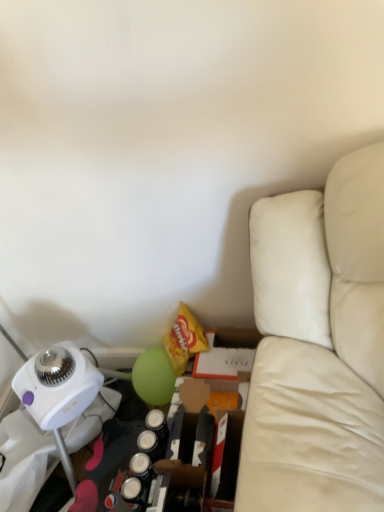
This screenshot has width=384, height=512. Identify the location of green matte balloon at lower center. (154, 377).

What do you see at coordinates (154, 377) in the screenshot?
I see `green matte balloon at lower center` at bounding box center [154, 377].

At what (x,y) coordinates should I click in order to perform the action: click on green matte balloon at lower center. Please return your answer as a coordinate pair (x, y). Image resolution: width=384 pixels, height=512 pixels. Looking at the image, I should click on (154, 377).